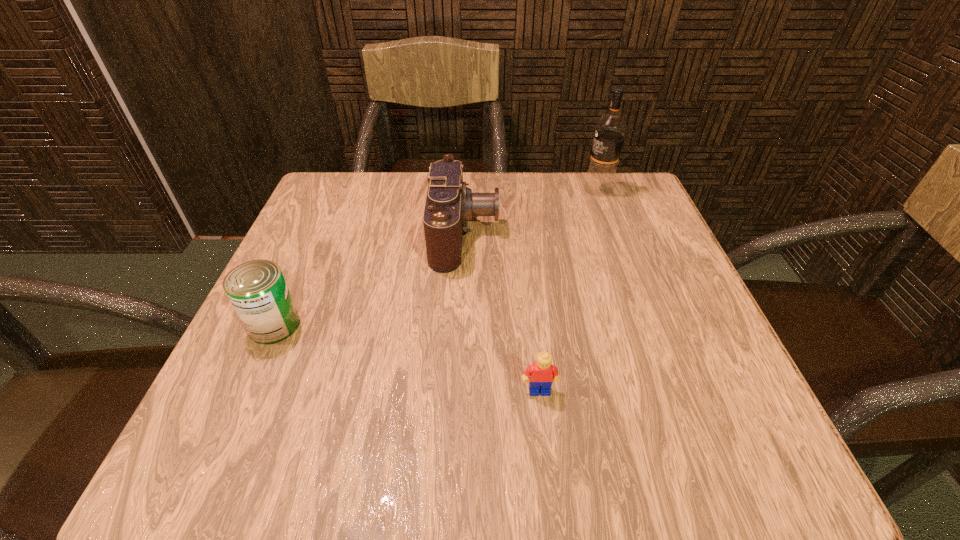
Identify the location of free point located on the label of the rightmost object. Image resolution: width=960 pixels, height=540 pixels. (445, 189).

Locate an element on the screen. The height and width of the screenshot is (540, 960). free space located 0.320m on the front-facing side of the second farthest object is located at coordinates (656, 234).

The image size is (960, 540). What are the coordinates of `vacant space situated on the right of the third tallest object` in the screenshot? It's located at click(x=372, y=325).

This screenshot has height=540, width=960. Find the location of `free location located on the face of the shortest object`. free location located on the face of the shortest object is located at coordinates (543, 430).

Image resolution: width=960 pixels, height=540 pixels. I want to click on vodka at the far edge, so pos(610,130).

This screenshot has width=960, height=540. Identify the location of camera that is at the far edge. (450, 204).

The height and width of the screenshot is (540, 960). I want to click on object at the left edge, so click(x=257, y=289).

The height and width of the screenshot is (540, 960). Identify the location of object at the right edge. (610, 130).

Locate an element on the screen. object that is at the far right corner is located at coordinates (610, 130).

The width and height of the screenshot is (960, 540). What are the coordinates of `vacant space at the far edge` in the screenshot? It's located at (485, 174).